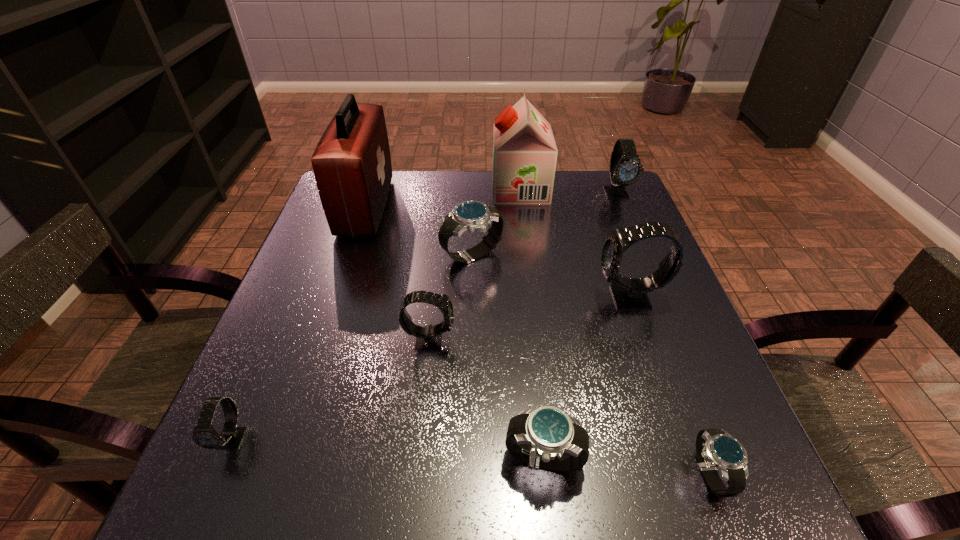
At what (x,y) coordinates should I click in order to perform the action: click on silver watch that is the closest to the second farthest watch. Please return your answer as a coordinate pair (x, y). Looking at the image, I should click on (546, 437).

The height and width of the screenshot is (540, 960). In order to click on silver watch that is the second closest to the second biggest silver watch in this screenshot , I will do `click(471, 215)`.

The image size is (960, 540). In order to click on vacant region that satisfies the following two spatial constraints: 1. on the back side of the shortest watch; 2. on the side of the first aid kit with the cross symbol in this screenshot , I will do `click(608, 207)`.

You are a GUI agent. You are given a task and a screenshot of the screen. Output one action in this format:
    pyautogui.click(x=<x>, y=<y>)
    Task: Click on the blank area in the image that satisfies the following two spatial constraints: 1. on the side of the red first aid kit with the cross symbol; 2. on the right side of the rightmost silver watch
    The image size is (960, 540).
    Given the screenshot: What is the action you would take?
    pyautogui.click(x=276, y=474)

Image resolution: width=960 pixels, height=540 pixels. In order to click on free location that satisfies the following two spatial constraints: 1. on the face of the shortest object; 2. on the right side of the leftmost watch in this screenshot , I will do `click(217, 474)`.